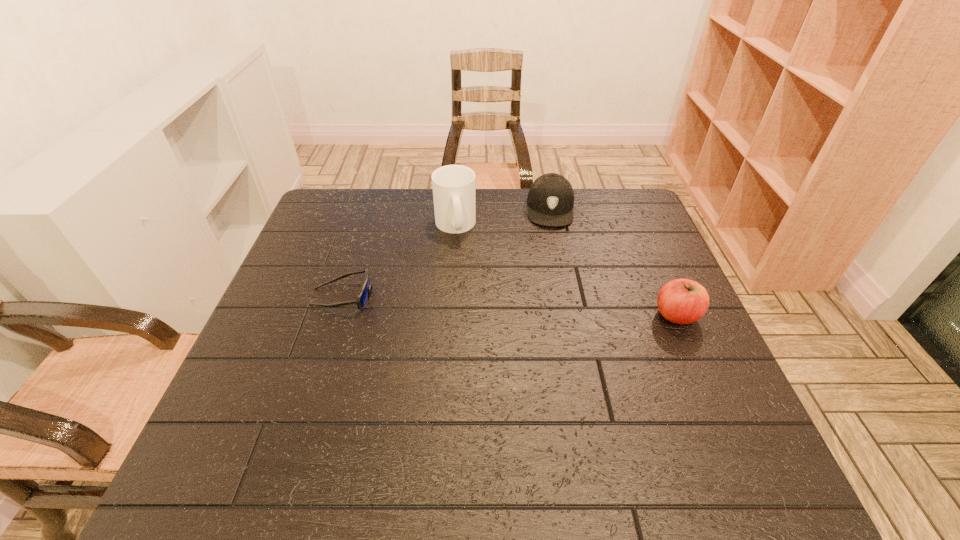
Image resolution: width=960 pixels, height=540 pixels. In the image, there is a desktop. In order to click on free space at the left edge in this screenshot , I will do `click(321, 343)`.

The image size is (960, 540). Find the location of `vacant space at the right edge`. vacant space at the right edge is located at coordinates (683, 325).

Where is `free space at the near left corner of the desktop`? free space at the near left corner of the desktop is located at coordinates (251, 423).

Locate an element on the screen. This screenshot has height=540, width=960. free location at the far right corner of the desktop is located at coordinates (596, 198).

The width and height of the screenshot is (960, 540). What are the coordinates of `blank region between the second object from left to right and the apple` in the screenshot? It's located at (565, 270).

Where is `free space between the apple and the shortest object`? The height and width of the screenshot is (540, 960). free space between the apple and the shortest object is located at coordinates pos(510,306).

Where is `free spot between the shortest object and the rightmost object`? This screenshot has width=960, height=540. free spot between the shortest object and the rightmost object is located at coordinates (510, 306).

I want to click on blank region between the rightmost object and the shortest object, so click(x=510, y=306).

Find the location of a particular element. empty space that is in between the mug and the apple is located at coordinates (565, 270).

This screenshot has width=960, height=540. I want to click on free area in between the cap and the rightmost object, so click(x=613, y=261).